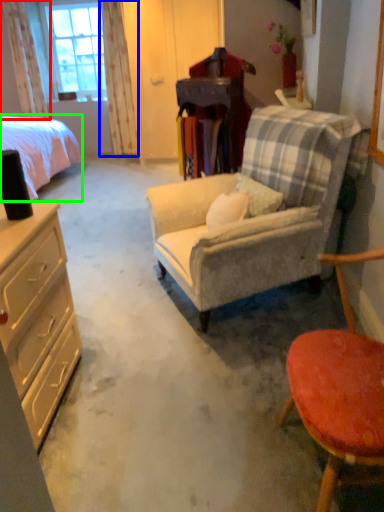
Question: Which object is positioned farthest from curtain (highlighted by a red box)? Select from curtain (highlighted by a blue box) and bed (highlighted by a green box).

Choices:
 (A) curtain
 (B) bed

Answer: (B)